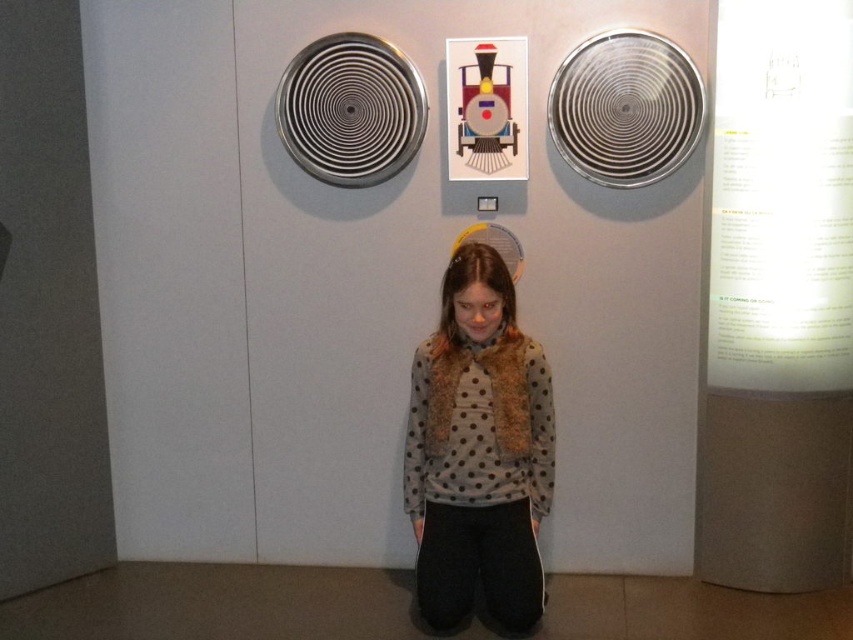
Question: Which of the following is the closest to the observer?

Choices:
 (A) metallic train at upper center
 (B) metallic spiral fan at upper right

Answer: (B)

Question: Is the position of polka dot sweater at center more distant than that of metallic spiral at upper center?

Choices:
 (A) yes
 (B) no

Answer: (B)

Question: Which object is the farthest from the metallic spiral fan at upper right?

Choices:
 (A) metallic spiral at upper center
 (B) polka dot sweater at center

Answer: (B)

Question: Does polka dot sweater at center appear on the right side of metallic spiral fan at upper right?

Choices:
 (A) yes
 (B) no

Answer: (B)

Question: Does metallic spiral fan at upper right appear over metallic train at upper center?

Choices:
 (A) yes
 (B) no

Answer: (B)

Question: Which object is positioned closest to the metallic train at upper center?

Choices:
 (A) polka dot sweater at center
 (B) metallic spiral fan at upper right
 (C) metallic spiral at upper center

Answer: (B)